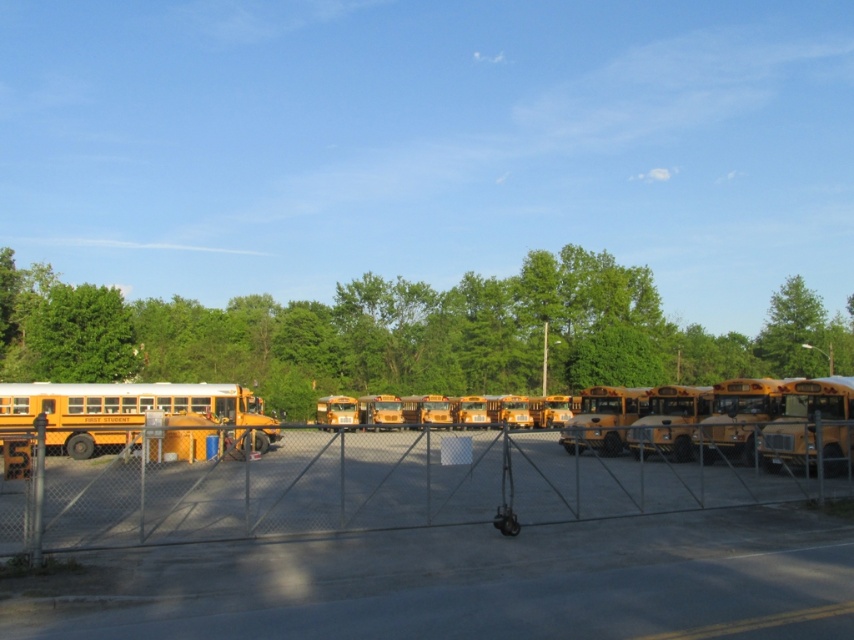
You are a delivery driver who needs to park your truck between the matte yellow school bus at left and the yellow matte school bus at right in the parking lot. The truck requires a minimum of 50 feet of space to maneuver. Can you safely park your truck between them?

The matte yellow school bus at left is 62.72 feet away from the yellow matte school bus at right. Since the truck requires a minimum of 50 feet of space, the distance between them is sufficient, so you can safely park your truck between them.